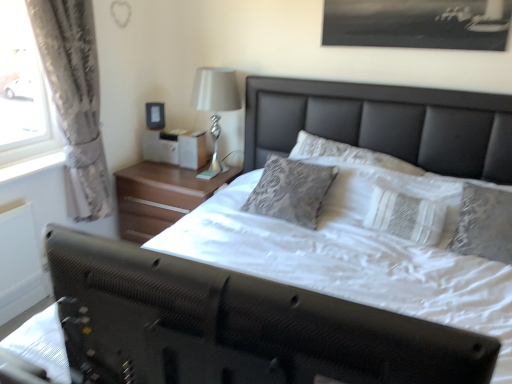
Locate an element on the screen. free spot above wooden nightstand at center (from a real-world perspective) is located at coordinates (169, 174).